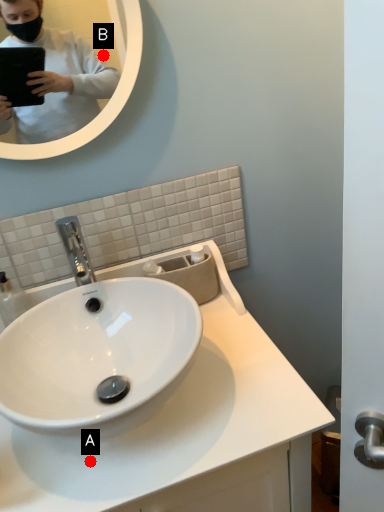
Question: Two points are circled on the image, labeled by A and B beside each circle. Among these points, which one is farthest from the camera?

Choices:
 (A) A is further
 (B) B is further

Answer: (B)